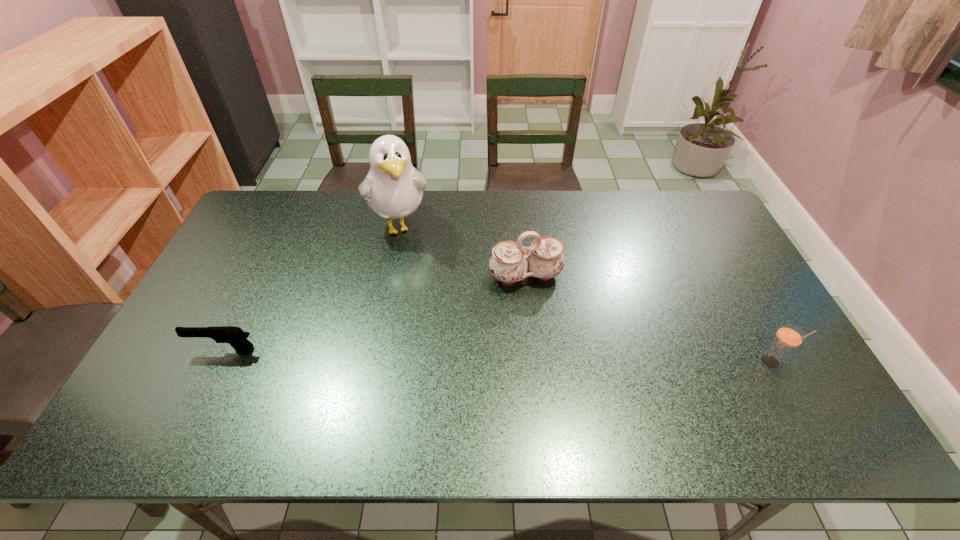
What are the coordinates of `vacant space on the desktop that is between the shortest object and the rightmost object and is positioned on the beak of the second object from left to right` in the screenshot? It's located at (439, 355).

Where is `free space on the desktop that is between the shortest object and the rightmost object and is positioned by the handle of the third nearest object`? The height and width of the screenshot is (540, 960). free space on the desktop that is between the shortest object and the rightmost object and is positioned by the handle of the third nearest object is located at coordinates (553, 357).